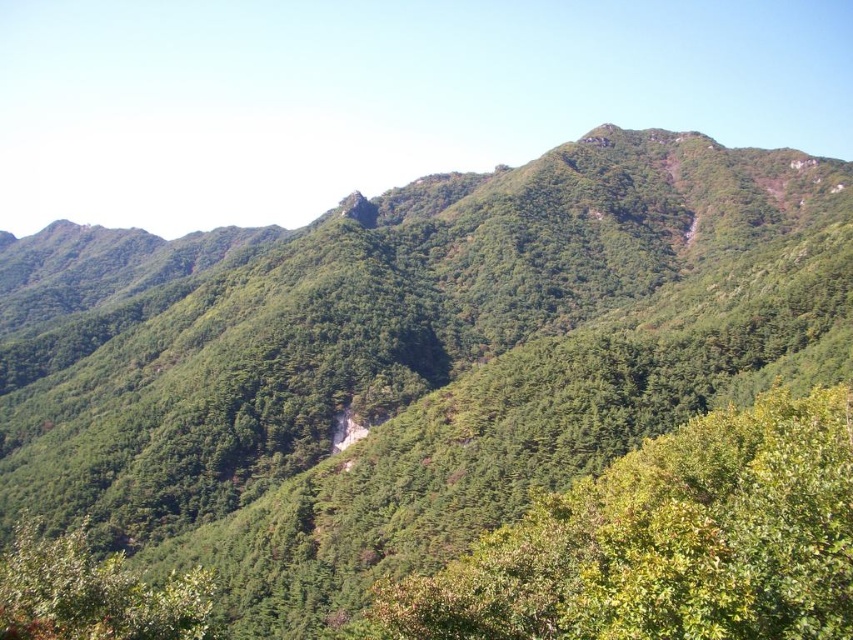
Where is `green leafy tree at center`? The height and width of the screenshot is (640, 853). green leafy tree at center is located at coordinates (664, 541).

Is point (589, 492) closer to viewer compared to point (53, 618)?

No, (589, 492) is behind (53, 618).

Is point (548, 637) positioned in front of point (86, 628)?

No, (548, 637) is further to viewer.

The height and width of the screenshot is (640, 853). I want to click on green leafy tree at center, so click(x=664, y=541).